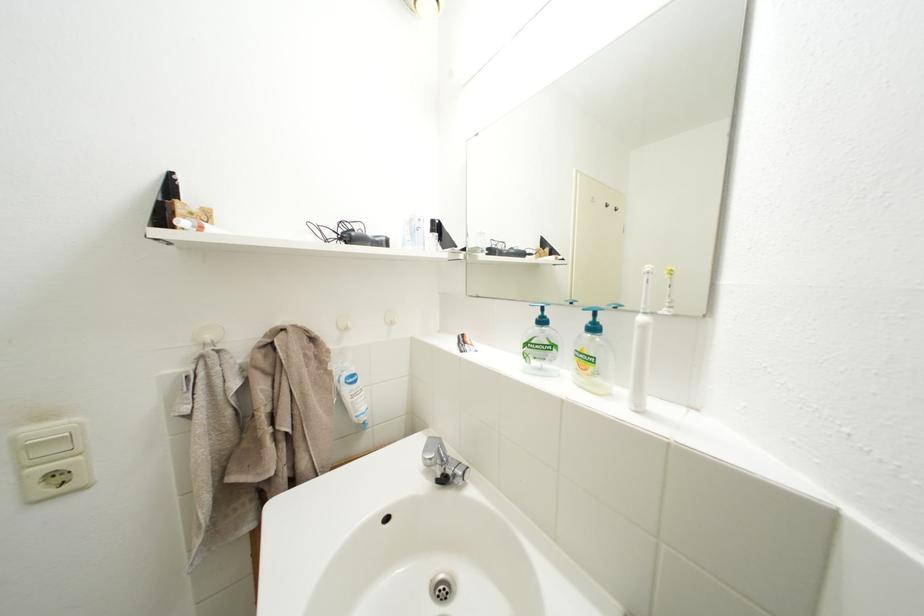
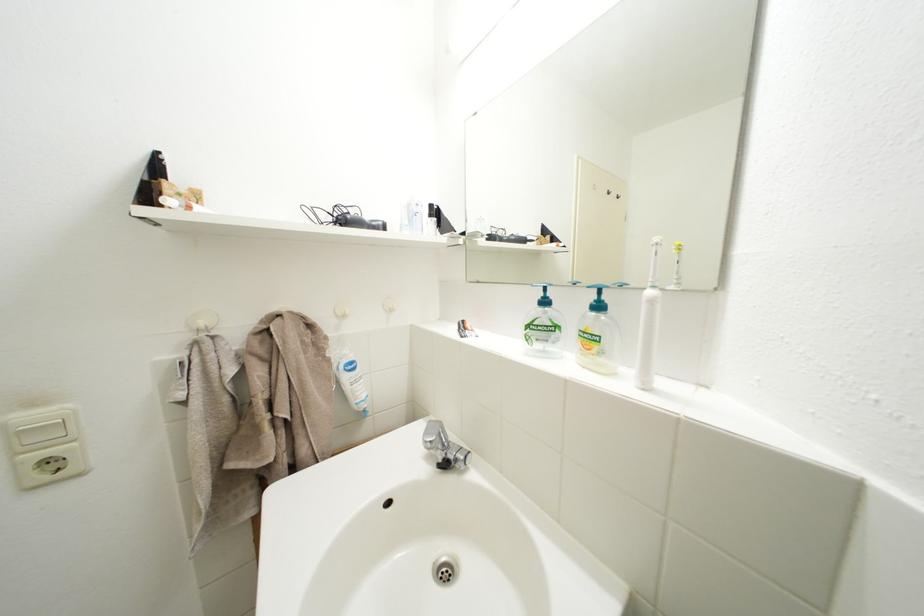
The point at (217,342) is marked in the first image. Where is the corresponding point in the second image?

(211, 329)